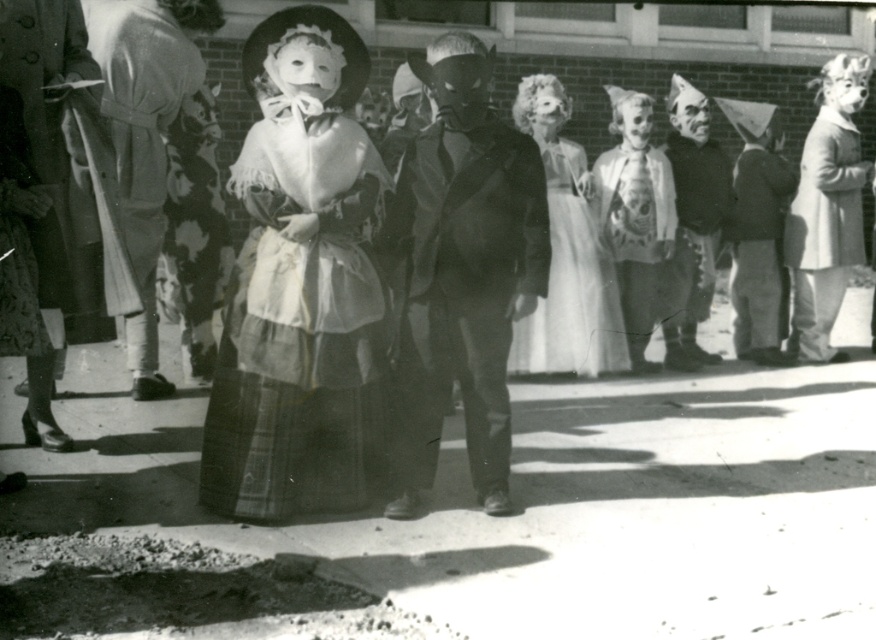
You are a photographer standing in front of the brick building and want to take a photo that includes both the smooth beige coat at right and the white lace dress at center. Which object is closer to you, the photographer?

The smooth beige coat at right is closer to the photographer because it is further to the viewer than the white lace dress at center.

You are a photographer adjusting your camera settings to focus on the plaid wool dress at center and the matte black mask at center. Which object should you focus on first if you want to ensure both are in focus?

You should focus on the plaid wool dress at center first because it is closer to the viewer than the matte black mask at center, so adjusting focus starting from the closer object ensures both can be in focus.

You are standing in front of the brick building and want to take a photo of the white lace dress at center. Where should you position yourself to capture it in the frame?

To capture the white lace dress at center in the frame, position yourself directly in front of the brick building, as the white lace dress at center is located at the central area of the image based on its 2D coordinates.